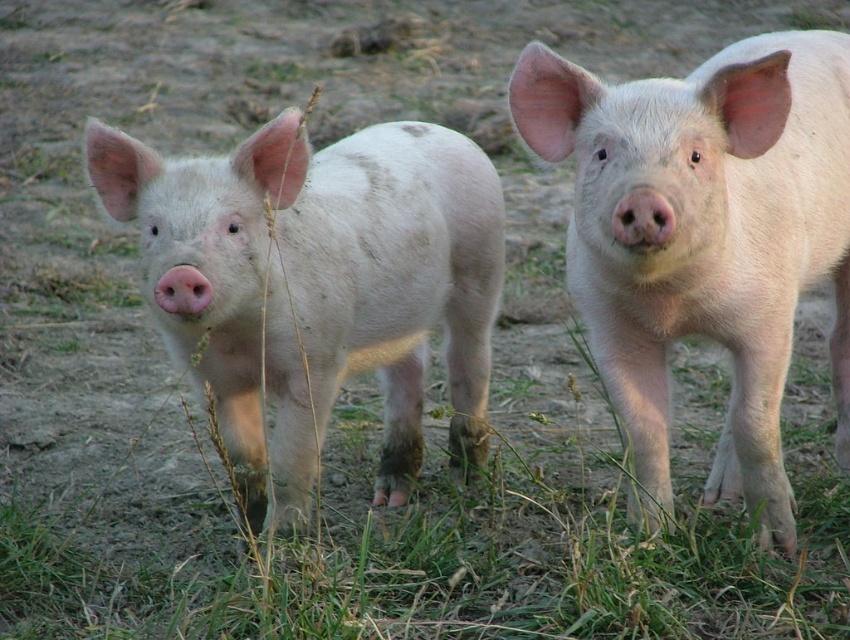
Question: Which of the following is the closest to the observer?

Choices:
 (A) (327, 371)
 (B) (654, 356)

Answer: (B)

Question: Does matte white piglet at center appear on the left side of pink smooth pig at center?

Choices:
 (A) no
 (B) yes

Answer: (B)

Question: Is matte white piglet at center bigger than pink smooth pig at center?

Choices:
 (A) no
 (B) yes

Answer: (A)

Question: Does matte white piglet at center lie in front of pink smooth pig at center?

Choices:
 (A) yes
 (B) no

Answer: (B)

Question: Which of the following is the closest to the observer?

Choices:
 (A) pink smooth pig at center
 (B) matte white piglet at center

Answer: (A)